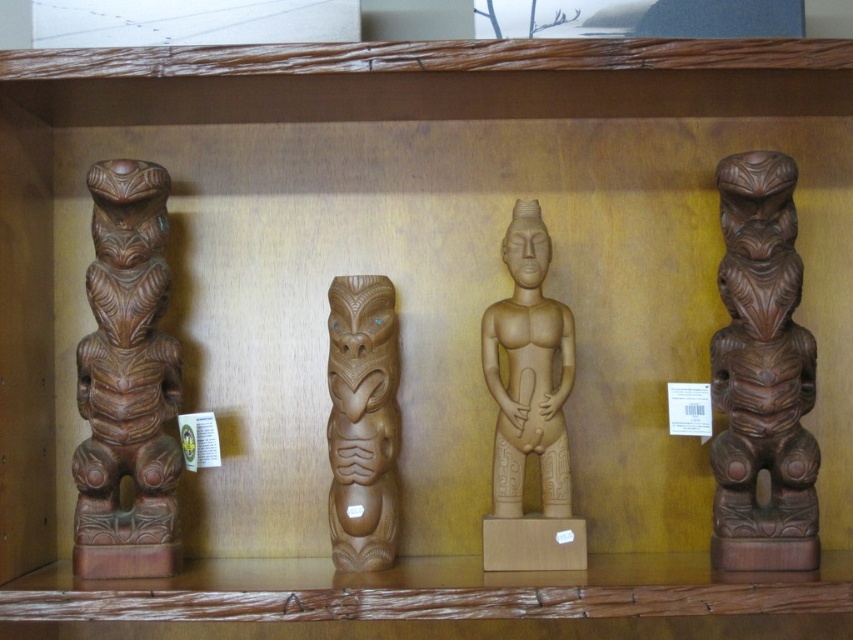
Question: Does brown wood totem pole at left appear under light brown wood statue at center?

Choices:
 (A) yes
 (B) no

Answer: (B)

Question: Where is brown wood carving at right located in relation to brown wood carving at center in the image?

Choices:
 (A) left
 (B) right

Answer: (B)

Question: Which point is closer to the camera taking this photo?

Choices:
 (A) (743, 444)
 (B) (525, 365)
 (C) (332, 340)
 (D) (103, 480)

Answer: (D)

Question: Can you confirm if brown wood totem pole at left is bigger than brown polished wood totem at left?

Choices:
 (A) no
 (B) yes

Answer: (B)

Question: Which of these objects is positioned closest to the light brown wood statue at center?

Choices:
 (A) brown wood carving at center
 (B) brown wood carving at right

Answer: (A)

Question: Which point is closer to the camera?

Choices:
 (A) brown wood totem pole at left
 (B) brown wood carving at center
 (C) brown wood carving at right

Answer: (C)